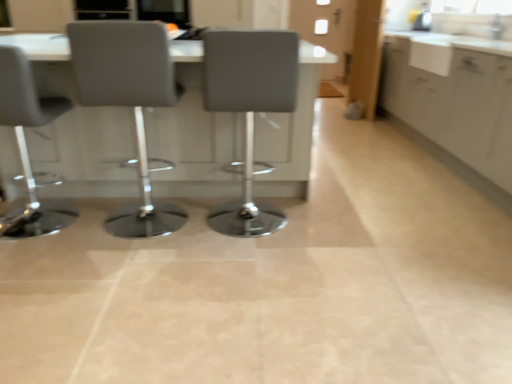
Image resolution: width=512 pixels, height=384 pixels. What do you see at coordinates (454, 98) in the screenshot? I see `white matte cabinet at right` at bounding box center [454, 98].

Find the location of `white matte cabinet at right`. white matte cabinet at right is located at coordinates (454, 98).

The width and height of the screenshot is (512, 384). I want to click on matte gray chair at center, which appears as the 2th chair when viewed from the right, so coord(129,102).

Describe the element at coordinates (249, 109) in the screenshot. I see `matte gray chair at center, which ranks as the 1th chair in right-to-left order` at that location.

Measure the distance between point (x=285, y=217) and camera.

Point (x=285, y=217) and camera are 2.58 meters apart.

The image size is (512, 384). What do you see at coordinates (165, 11) in the screenshot?
I see `matte black screen at upper center` at bounding box center [165, 11].

Describe the element at coordinates (26, 145) in the screenshot. The width and height of the screenshot is (512, 384). I see `matte gray chair at left, the 1th chair viewed from the left` at that location.

What do you see at coordinates (193, 135) in the screenshot? I see `white glossy table at center` at bounding box center [193, 135].

You are a GUI agent. You are given a task and a screenshot of the screen. Output one action in this format:
    pyautogui.click(x=<x>, y=<y>)
    Task: Click on the white matte cabinet at right
    This screenshot has width=512, height=384.
    Given the screenshot: What is the action you would take?
    [x=454, y=98]

Is matte gray chair at center, positioned as the third chair in left-to-right order, not within matte gray chair at left, which appears as the third chair when viewed from the right?

That's correct, matte gray chair at center, positioned as the third chair in left-to-right order, is outside of matte gray chair at left, which appears as the third chair when viewed from the right.

Is matte gray chair at center, which ranks as the 1th chair in right-to-left order, touching matte gray chair at left, which appears as the third chair when viewed from the right?

No, matte gray chair at center, which ranks as the 1th chair in right-to-left order, is not next to matte gray chair at left, which appears as the third chair when viewed from the right.

In the scene shown: From the image's perspective, is matte gray chair at center, positioned as the third chair in left-to-right order, below matte gray chair at left, which appears as the third chair when viewed from the right?

Actually, matte gray chair at center, positioned as the third chair in left-to-right order, appears above matte gray chair at left, which appears as the third chair when viewed from the right, in the image.

The height and width of the screenshot is (384, 512). Find the location of `the 1st chair above the matte gray chair at left, the 1th chair viewed from the left (from a real-world perspective)`. the 1st chair above the matte gray chair at left, the 1th chair viewed from the left (from a real-world perspective) is located at coordinates click(249, 109).

Can you tell me how much white glossy table at center and matte gray chair at left, the 1th chair viewed from the left, differ in facing direction?

They differ by 2.22 degrees in their facing directions.

From the image's perspective, which object appears higher, white glossy table at center or matte gray chair at left, the 1th chair viewed from the left?

white glossy table at center.

Considering the points (88, 173) and (58, 211), which point is in front, point (88, 173) or point (58, 211)?

Positioned in front is point (88, 173).

Could you tell me if matte black screen at upper center is facing matte gray chair at center, which ranks as the 1th chair in right-to-left order?

Yes.

From a real-world perspective, which object rests below the other?

matte gray chair at center, which ranks as the 1th chair in right-to-left order, from a real-world perspective.

Considering the relative sizes of matte black screen at upper center and matte gray chair at center, which ranks as the 1th chair in right-to-left order, in the image provided, is matte black screen at upper center wider than matte gray chair at center, which ranks as the 1th chair in right-to-left order,?

Incorrect, the width of matte black screen at upper center does not surpass that of matte gray chair at center, which ranks as the 1th chair in right-to-left order.

Can you confirm if matte black screen at upper center is smaller than matte gray chair at center, positioned as the third chair in left-to-right order?

Indeed, matte black screen at upper center has a smaller size compared to matte gray chair at center, positioned as the third chair in left-to-right order.

Does white matte cabinet at right have a larger size compared to white glossy countertop at upper right?

Yes, white matte cabinet at right is bigger than white glossy countertop at upper right.

Does white matte cabinet at right appear on the right side of white glossy countertop at upper right?

Yes, white matte cabinet at right is to the right of white glossy countertop at upper right.

Where is `counter top lying behind the white matte cabinet at right`? Image resolution: width=512 pixels, height=384 pixels. counter top lying behind the white matte cabinet at right is located at coordinates (445, 49).

From the image's perspective, is white matte cabinet at right located above or below white glossy countertop at upper right?

white matte cabinet at right is situated lower than white glossy countertop at upper right in the image.

Based on the photo, is matte black screen at upper center at the right side of white glossy countertop at upper right?

Incorrect, matte black screen at upper center is not on the right side of white glossy countertop at upper right.

Between matte black screen at upper center and white glossy countertop at upper right, which one has larger width?

With larger width is white glossy countertop at upper right.

From a real-world perspective, is matte black screen at upper center over white glossy countertop at upper right?

Indeed, from a real-world perspective, matte black screen at upper center stands above white glossy countertop at upper right.

From the image's perspective, which is above, matte black screen at upper center or white glossy countertop at upper right?

From the image's view, matte black screen at upper center is above.

Can you tell me how much matte gray chair at center, which ranks as the 1th chair in right-to-left order, and matte black screen at upper center differ in facing direction?

The angular difference between matte gray chair at center, which ranks as the 1th chair in right-to-left order, and matte black screen at upper center is 179 degrees.

Consider the image. Would you consider matte gray chair at center, which ranks as the 1th chair in right-to-left order, to be distant from matte black screen at upper center?

Yes, matte gray chair at center, which ranks as the 1th chair in right-to-left order, and matte black screen at upper center are located far from each other.

Is matte gray chair at center, positioned as the third chair in left-to-right order, aimed at matte black screen at upper center?

Yes, matte gray chair at center, positioned as the third chair in left-to-right order, faces towards matte black screen at upper center.

Which of these two, white matte cabinet at right or matte black screen at upper center, is thinner?

matte black screen at upper center.

Would you say white matte cabinet at right is a long distance from matte black screen at upper center?

Absolutely, white matte cabinet at right is distant from matte black screen at upper center.

Is matte black screen at upper center at the back of white matte cabinet at right?

No, white matte cabinet at right is not facing away from matte black screen at upper center.

From the image's perspective, who appears lower, white matte cabinet at right or matte black screen at upper center?

white matte cabinet at right appears lower in the image.

Find the location of a particular element. The image size is (512, 384). the 2nd chair to the right of the matte gray chair at left, the 1th chair viewed from the left, counting from the anchor's position is located at coordinates (249, 109).

I want to click on table above the matte gray chair at left, which appears as the third chair when viewed from the right (from the image's perspective), so click(x=193, y=135).

From the image, which object appears to be farther from matte gray chair at center, which appears as the 2th chair when viewed from the right, matte gray chair at center, positioned as the third chair in left-to-right order, or white glossy table at center?

Among the two, white glossy table at center is located further to matte gray chair at center, which appears as the 2th chair when viewed from the right.

Based on their spatial positions, is white matte cabinet at right or matte black screen at upper center closer to matte gray chair at center, which ranks as the 1th chair in right-to-left order?

Among the two, white matte cabinet at right is located nearer to matte gray chair at center, which ranks as the 1th chair in right-to-left order.

Estimate the real-world distances between objects in this image. Which object is closer to matte gray chair at center, acting as the 2th chair starting from the left, white glossy table at center or matte gray chair at left, the 1th chair viewed from the left?

matte gray chair at left, the 1th chair viewed from the left, is closer to matte gray chair at center, acting as the 2th chair starting from the left.

Which object lies nearer to the anchor point matte black screen at upper center, matte gray chair at center, which ranks as the 1th chair in right-to-left order, or white glossy countertop at upper right?

white glossy countertop at upper right.

Based on their spatial positions, is white glossy table at center or matte black screen at upper center further from matte gray chair at center, which appears as the 2th chair when viewed from the right?

matte black screen at upper center is further to matte gray chair at center, which appears as the 2th chair when viewed from the right.

When comparing their distances from white glossy countertop at upper right, does matte gray chair at left, the 1th chair viewed from the left, or matte gray chair at center, which ranks as the 1th chair in right-to-left order, seem closer?

Among the two, matte gray chair at center, which ranks as the 1th chair in right-to-left order, is located nearer to white glossy countertop at upper right.

Estimate the real-world distances between objects in this image. Which object is further from white glossy table at center, matte gray chair at left, which appears as the third chair when viewed from the right, or matte black screen at upper center?

matte black screen at upper center lies further to white glossy table at center than the other object.

Based on their spatial positions, is white matte cabinet at right or matte gray chair at center, which ranks as the 1th chair in right-to-left order, closer to matte gray chair at left, which appears as the third chair when viewed from the right?

Among the two, matte gray chair at center, which ranks as the 1th chair in right-to-left order, is located nearer to matte gray chair at left, which appears as the third chair when viewed from the right.

At what (x,y) coordinates should I click in order to perform the action: click on table positioned between matte gray chair at left, the 1th chair viewed from the left, and matte black screen at upper center from near to far. Please return your answer as a coordinate pair (x, y). This screenshot has width=512, height=384. Looking at the image, I should click on (193, 135).

You are a GUI agent. You are given a task and a screenshot of the screen. Output one action in this format:
    pyautogui.click(x=<x>, y=<y>)
    Task: Click on the table between matte gray chair at left, the 1th chair viewed from the left, and matte gray chair at center, which appears as the 2th chair when viewed from the right, in the horizontal direction
    
    Given the screenshot: What is the action you would take?
    pyautogui.click(x=193, y=135)

What are the coordinates of `counter top situated between matte gray chair at left, which appears as the third chair when viewed from the right, and white matte cabinet at right from left to right` in the screenshot? It's located at (445, 49).

Where is `table between matte black screen at upper center and white matte cabinet at right from left to right`? The width and height of the screenshot is (512, 384). table between matte black screen at upper center and white matte cabinet at right from left to right is located at coordinates 193,135.